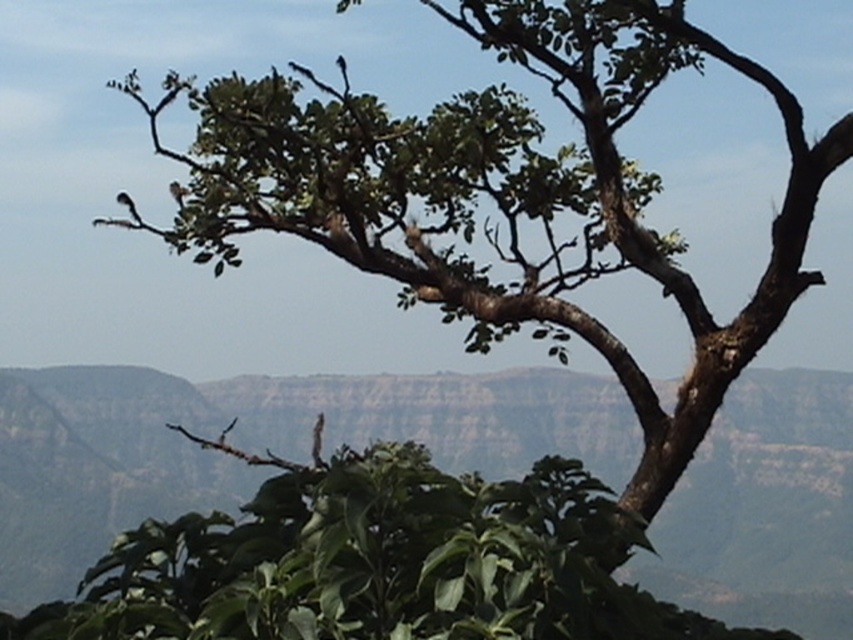
You are a photographer aiming to capture the green leafy tree at center and the white feathered bird at upper left in the same frame. Based on their sizes in the image, which object would appear larger in your photo?

The green leafy tree at center would appear larger in the photo because it is wider than the white feathered bird at upper left.

You are standing at the center of the image. Which direction should you move to get closer to the green leafy tree at center?

Since the green leafy tree at center is already at the center of the image, you don not need to move in any direction to get closer to it. You are already at the optimal position.

You are standing in the natural landscape and want to take a photo of the green leafy tree at center and the white feathered bird at upper left. Which object should you focus on first to ensure both are in clear view?

You should focus on the green leafy tree at center first because it is closer to you than the white feathered bird at upper left. By focusing on the closer object, the bird will also be in focus due to the depth of field.